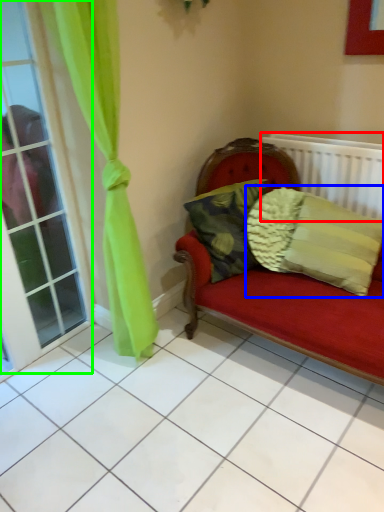
Question: Considering the real-world distances, which object is closest to radiator (highlighted by a red box)? pillow (highlighted by a blue box) or window (highlighted by a green box).

Choices:
 (A) pillow
 (B) window

Answer: (A)